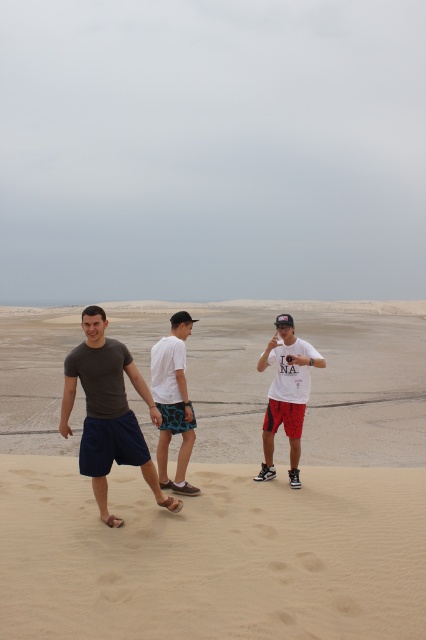
Where is `beige sandy beach at lower center`? beige sandy beach at lower center is located at coordinates (213, 556).

Who is more distant from viewer, (356, 566) or (296, 452)?

Point (296, 452)

Identify the location of beige sandy beach at lower center. The image size is (426, 640). (213, 556).

Does dark gray matte t-shirt at center appear on the left side of white matte t-shirt at center?

Indeed, dark gray matte t-shirt at center is positioned on the left side of white matte t-shirt at center.

Which of these two, dark gray matte t-shirt at center or white matte t-shirt at center, stands shorter?

white matte t-shirt at center is shorter.

Who is more distant from viewer, (132, 452) or (293, 333)?

The point (293, 333) is behind.

Locate an element on the screen. dark gray matte t-shirt at center is located at coordinates (108, 412).

Between beige sandy beach at lower center and white matte shorts at center, which one is positioned higher?

white matte shorts at center is higher up.

Measure the distance between point [218,636] and camera.

Point [218,636] and camera are 14.83 feet apart.

What are the coordinates of `beige sandy beach at lower center` in the screenshot? It's located at (213, 556).